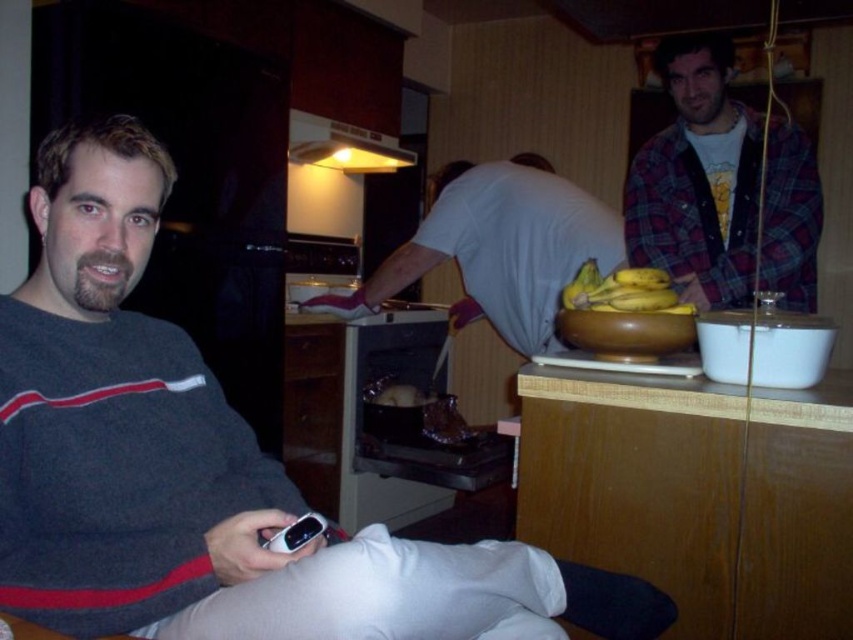
Is gray striped sweater at left smaller than flannel shirt at upper right?

Actually, gray striped sweater at left might be larger than flannel shirt at upper right.

Between gray striped sweater at left and flannel shirt at upper right, which one has less height?

With less height is flannel shirt at upper right.

I want to click on gray striped sweater at left, so click(x=204, y=465).

Where is `gray striped sweater at left`? Image resolution: width=853 pixels, height=640 pixels. gray striped sweater at left is located at coordinates (204, 465).

Image resolution: width=853 pixels, height=640 pixels. Find the location of `gray striped sweater at left`. gray striped sweater at left is located at coordinates (204, 465).

In the scene shown: Can you confirm if gray striped sweater at left is positioned to the right of yellow matte bananas at upper right?

Incorrect, gray striped sweater at left is not on the right side of yellow matte bananas at upper right.

Locate an element on the screen. gray striped sweater at left is located at coordinates (204, 465).

Does flannel shirt at upper right have a larger size compared to yellow matte bananas at upper right?

Yes.

Who is positioned more to the left, flannel shirt at upper right or yellow matte bananas at upper right?

yellow matte bananas at upper right

Is point (776, 237) closer to viewer compared to point (614, 310)?

No, (776, 237) is behind (614, 310).

Where is `flannel shirt at upper right`? Image resolution: width=853 pixels, height=640 pixels. flannel shirt at upper right is located at coordinates (722, 188).